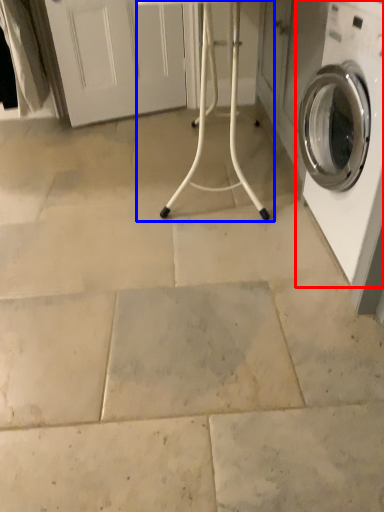
Question: Which of the following is the closest to the observer, washing machine (highlighted by a red box) or table (highlighted by a blue box)?

Choices:
 (A) washing machine
 (B) table

Answer: (A)